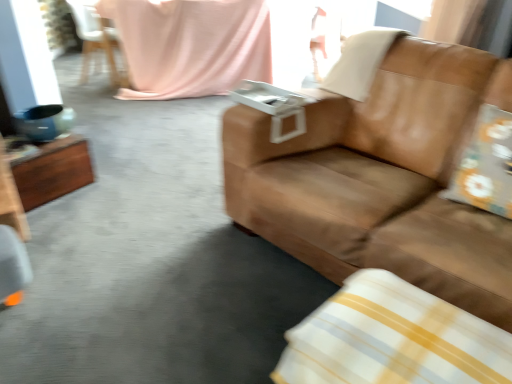
This screenshot has height=384, width=512. I want to click on vacant area that lies in front of wooden table at left, so click(x=53, y=227).